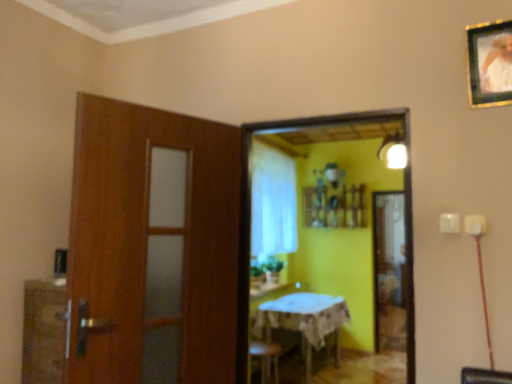
Question: Is matte white light fixture at upper right to the right of white sheer curtain at center from the viewer's perspective?

Choices:
 (A) no
 (B) yes

Answer: (B)

Question: From the image's perspective, is matte white light fixture at upper right on white sheer curtain at center?

Choices:
 (A) yes
 (B) no

Answer: (A)

Question: Could you tell me if matte white light fixture at upper right is facing white sheer curtain at center?

Choices:
 (A) yes
 (B) no

Answer: (B)

Question: Considering the relative sizes of matte white light fixture at upper right and white sheer curtain at center in the image provided, is matte white light fixture at upper right shorter than white sheer curtain at center?

Choices:
 (A) no
 (B) yes

Answer: (B)

Question: From a real-world perspective, is matte white light fixture at upper right positioned under white sheer curtain at center based on gravity?

Choices:
 (A) yes
 (B) no

Answer: (B)

Question: Is matte white light fixture at upper right bigger than white sheer curtain at center?

Choices:
 (A) yes
 (B) no

Answer: (B)

Question: Can you confirm if matte white light fixture at upper right is smaller than wooden framed mirror at center?

Choices:
 (A) yes
 (B) no

Answer: (A)

Question: Does matte white light fixture at upper right have a larger size compared to wooden framed mirror at center?

Choices:
 (A) yes
 (B) no

Answer: (B)

Question: Is matte white light fixture at upper right thinner than wooden framed mirror at center?

Choices:
 (A) yes
 (B) no

Answer: (B)

Question: Is there a large distance between matte white light fixture at upper right and wooden framed mirror at center?

Choices:
 (A) yes
 (B) no

Answer: (A)

Question: Does matte white light fixture at upper right have a greater height compared to wooden framed mirror at center?

Choices:
 (A) yes
 (B) no

Answer: (B)

Question: Is the surface of matte white light fixture at upper right in direct contact with wooden framed mirror at center?

Choices:
 (A) no
 (B) yes

Answer: (A)

Question: Are white sheer curtain at center and wooden framed portrait at upper right making contact?

Choices:
 (A) yes
 (B) no

Answer: (B)